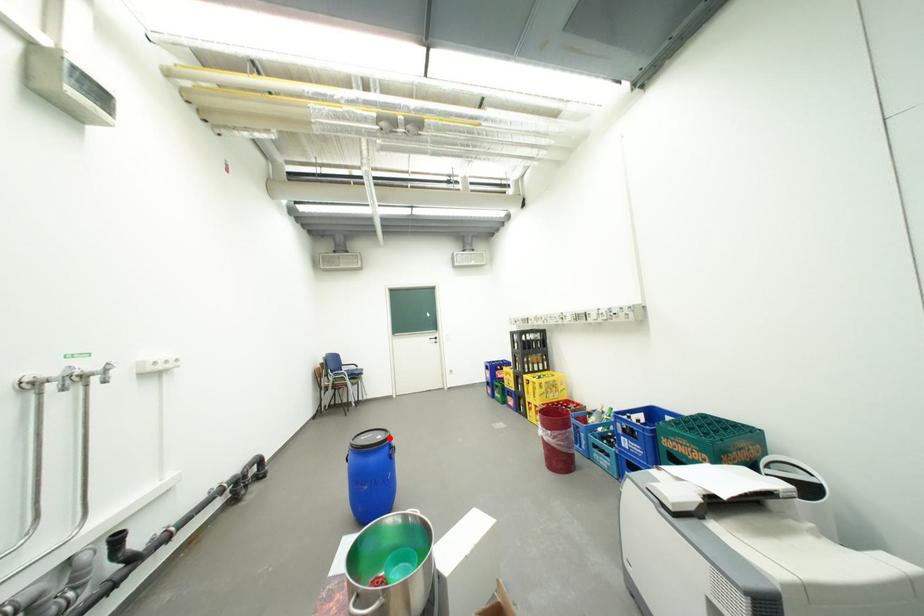
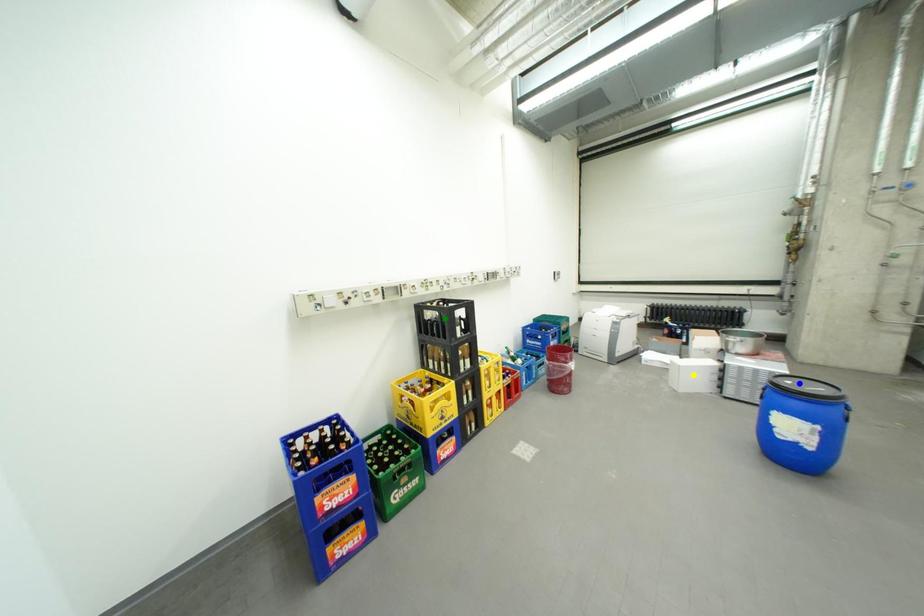
Question: I am providing you with two images of the same scene from different viewpoints. A red point is marked on the first image. You are given multiple points on the second image. Can you choose the point in image 2 that corresponds to the point in image 1?

Choices:
 (A) yellow point
 (B) blue point
 (C) green point

Answer: (B)